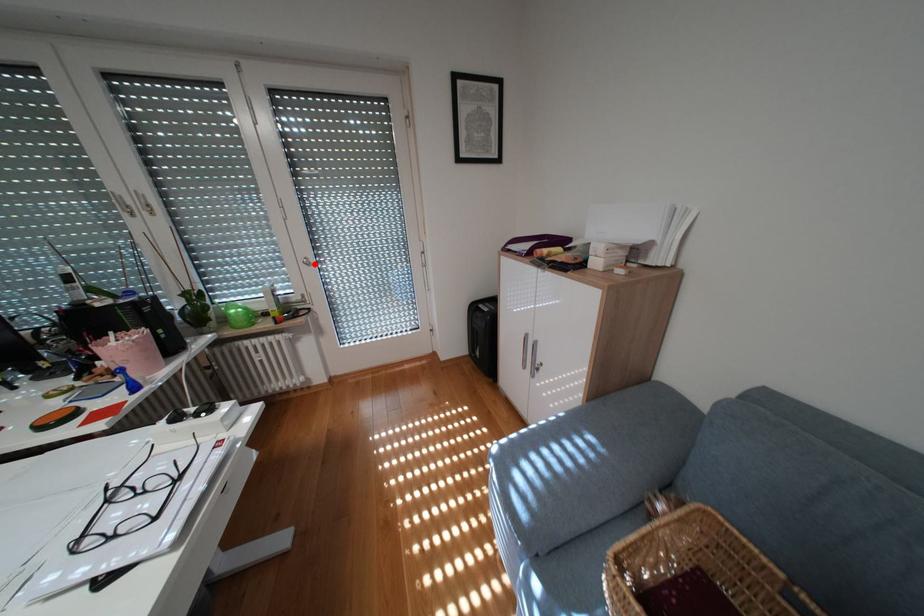
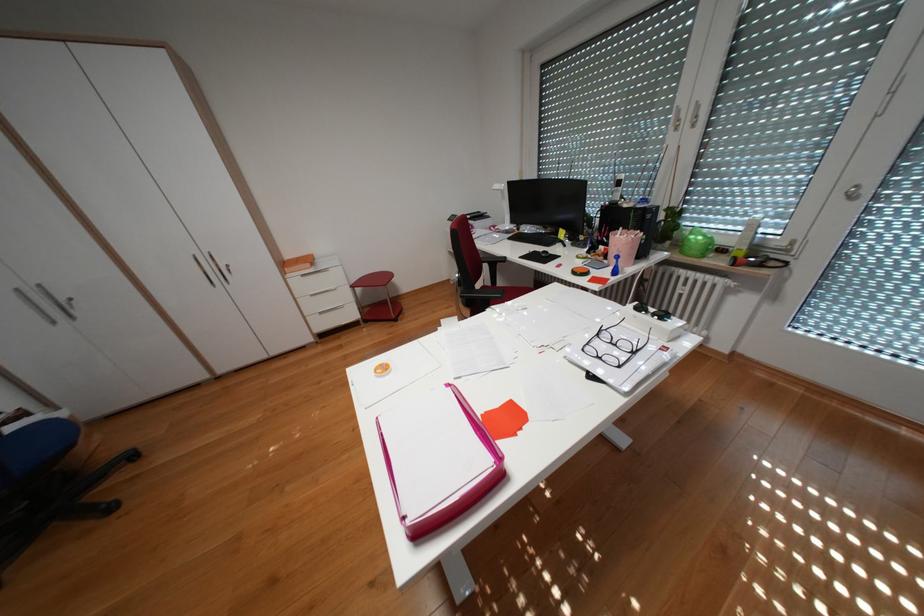
Where in the second image is the point corresponding to the highlighted location from the first image?

(850, 196)